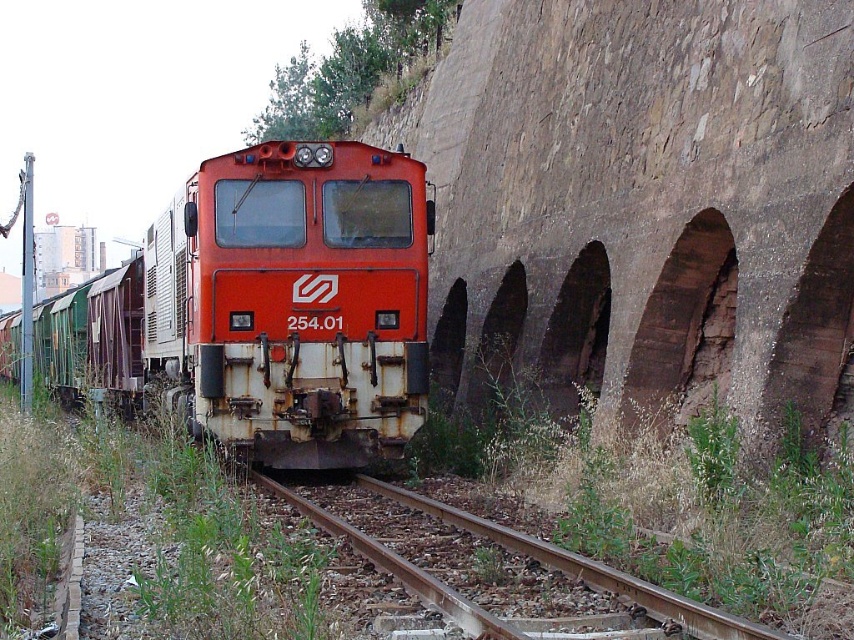
Question: Is rusty metal train at center further to camera compared to brown gravel train track at center?

Choices:
 (A) no
 (B) yes

Answer: (B)

Question: Does rusty metal train at center have a lesser width compared to brown gravel train track at center?

Choices:
 (A) yes
 (B) no

Answer: (B)

Question: Where is rusty metal train at center located in relation to brown gravel train track at center in the image?

Choices:
 (A) below
 (B) above

Answer: (B)

Question: Which object appears closest to the camera in this image?

Choices:
 (A) brown gravel train track at center
 (B) rusty metal train at center

Answer: (A)